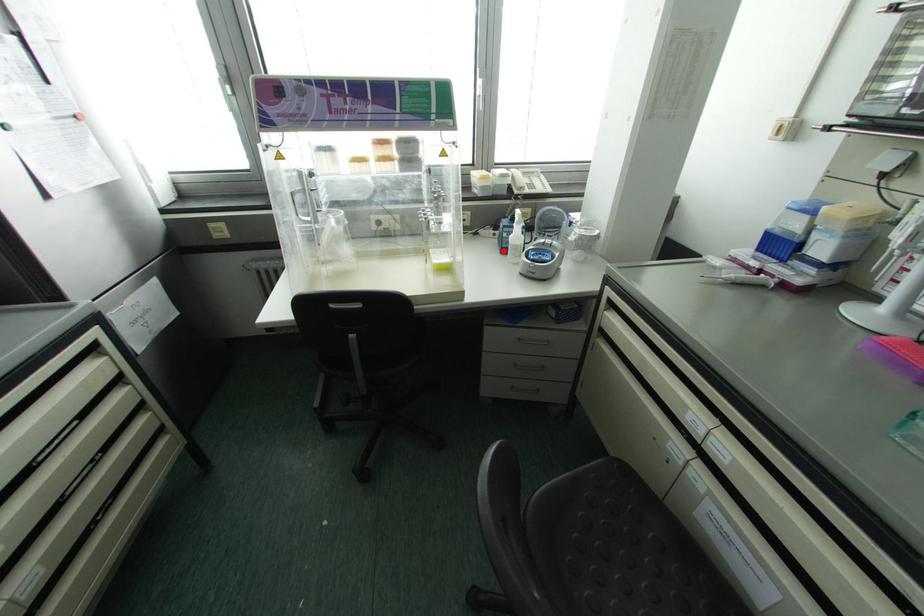
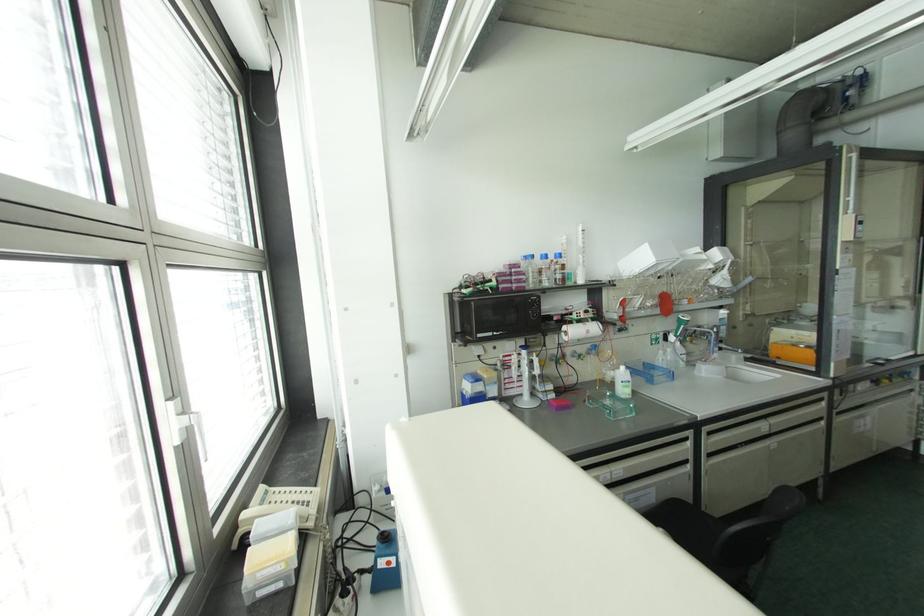
Question: I am providing you with two images of the same scene from different viewpoints. A red point is marked on the first image. Can you still see the location of the red point in image 2?

Choices:
 (A) Yes
 (B) No

Answer: (B)